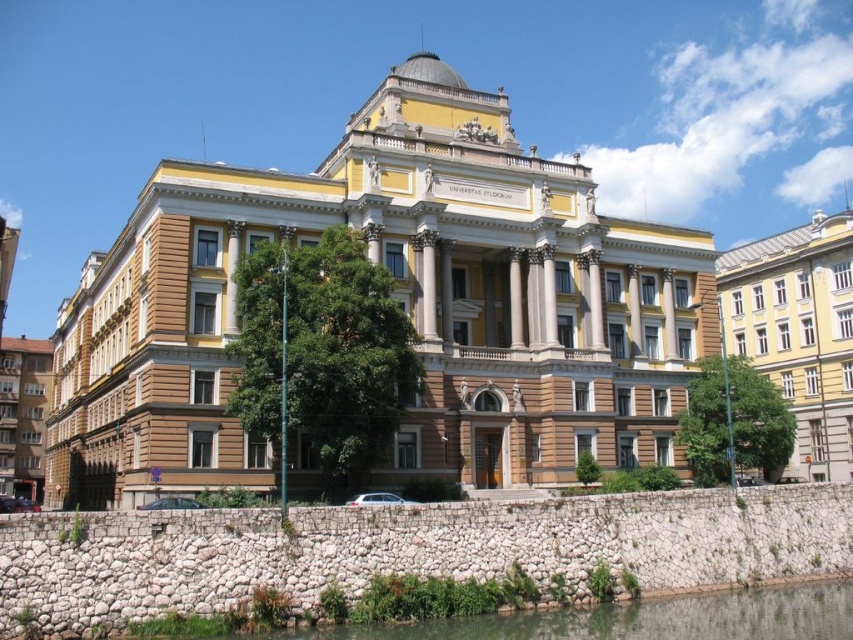
Is yellow matte building at right smaller than clear water at lower center?

Actually, yellow matte building at right might be larger than clear water at lower center.

From the picture: Does yellow matte building at right have a lesser width compared to clear water at lower center?

No.

Identify the location of yellow matte building at right. The width and height of the screenshot is (853, 640). (798, 332).

Identify the location of yellow matte building at right. (798, 332).

Identify the location of brown stone building at center. (399, 304).

Can you confirm if brown stone building at center is wider than clear water at lower center?

Yes, brown stone building at center is wider than clear water at lower center.

Is point (474, 218) in front of point (624, 634)?

No, it is behind (624, 634).

The image size is (853, 640). What are the coordinates of `brown stone building at center` in the screenshot? It's located at (399, 304).

Who is more forward, (82, 422) or (846, 344)?

Point (82, 422) is in front.

Which is above, brown stone building at center or yellow matte building at right?

brown stone building at center is above.

Does point (273, 209) lie in front of point (816, 317)?

That is True.

Find the location of a particular element. brown stone building at center is located at coordinates (399, 304).